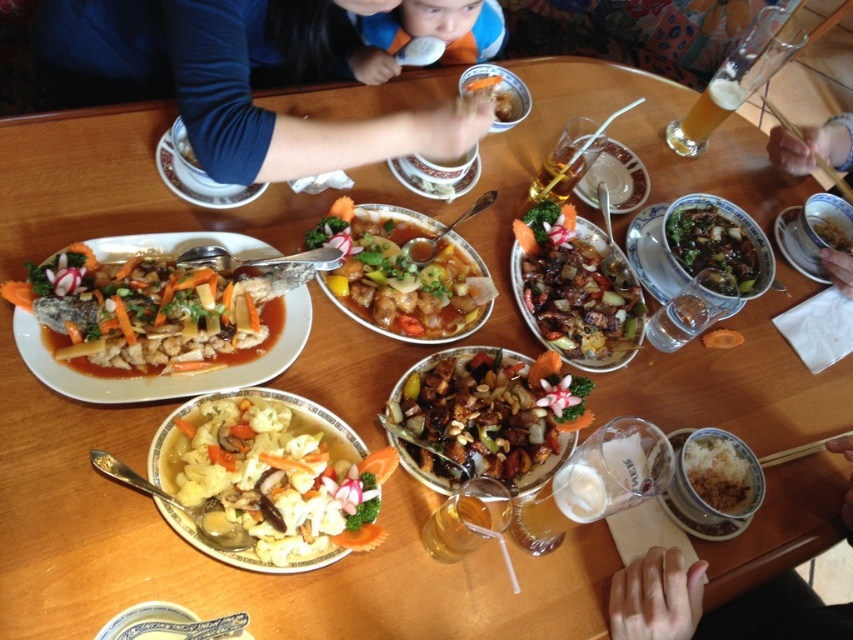
Question: Is white rice at lower right closer to the viewer compared to white porcelain bowl at center?

Choices:
 (A) no
 (B) yes

Answer: (B)

Question: Estimate the real-world distances between objects in this image. Which object is closer to the smooth skin hand at lower right?

Choices:
 (A) orange fabric shirt at upper center
 (B) porcelain bowl at lower center
 (C) dark brown glossy stir-fry at center

Answer: (C)

Question: Is blue fabric shirt at upper center below white glossy plate at upper center?

Choices:
 (A) yes
 (B) no

Answer: (B)

Question: Based on their relative distances, which object is farther from the saucey glossy fish at center?

Choices:
 (A) brown glossy meat at center
 (B) matte brown bowl at upper right
 (C) orange fabric shirt at upper center
 (D) white creamy soup with mixed vegetables at center

Answer: (B)

Question: Estimate the real-world distances between objects in this image. Which object is farther from the dark brown glossy stir-fry at center?

Choices:
 (A) slightly charred meat at center
 (B) white porcelain bowl at center
 (C) slightly translucent glass at upper center

Answer: (B)

Question: From the image, what is the correct spatial relationship of slightly browned glazed fish at left in relation to clear glass plate at center?

Choices:
 (A) above
 (B) below

Answer: (B)